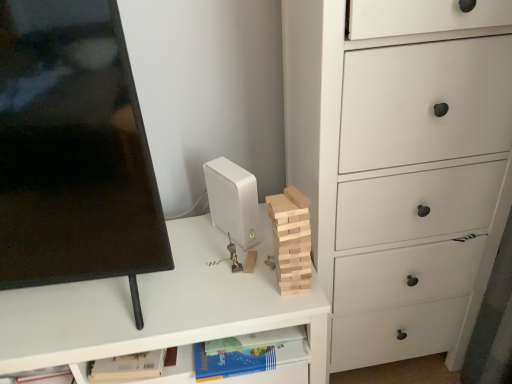
Identify the location of free point below black glossy computer monitor at left (from a real-world perspective). This screenshot has width=512, height=384. (75, 305).